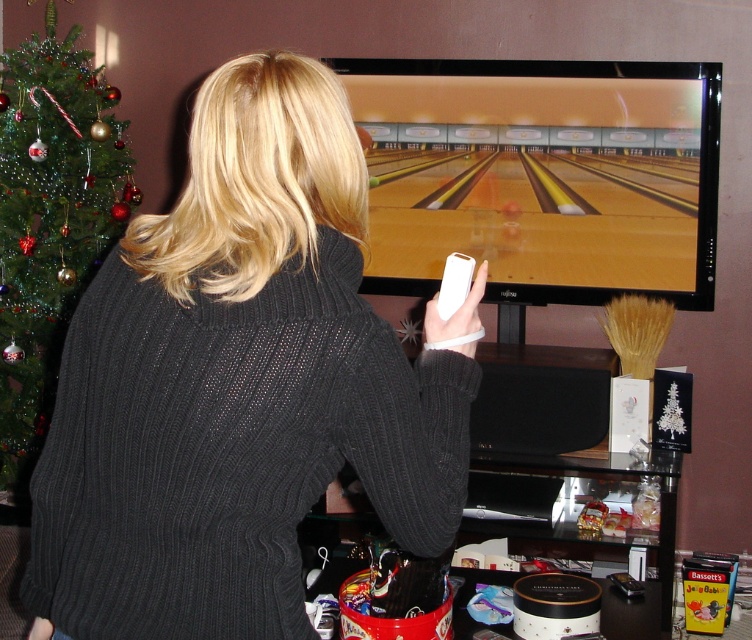
You are a guest in this room and want to take a photo of the green textured christmas tree at left without including the black ribbed sweater at center in the frame. Based on their positions, is this possible?

The black ribbed sweater at center is positioned on the right side of the green textured christmas tree at left. Since the sweater is to the right of the tree, you can move to the right of the sweater and angle your camera to capture only the tree without the sweater in the frame.

You are a guest at a holiday party and notice the black ribbed sweater at center and the green textured christmas tree at left in the room. Which object takes up more space visually in the scene?

The green textured christmas tree at left takes up more space visually in the scene because it is larger than the black ribbed sweater at center.

You are trying to locate the black ribbed sweater at center in the image. The coordinates given are point (235, 385). Can you confirm if this point is correctly placed on the black ribbed sweater at center?

Yes, the point (235, 385) is correctly placed on the black ribbed sweater at center as described.